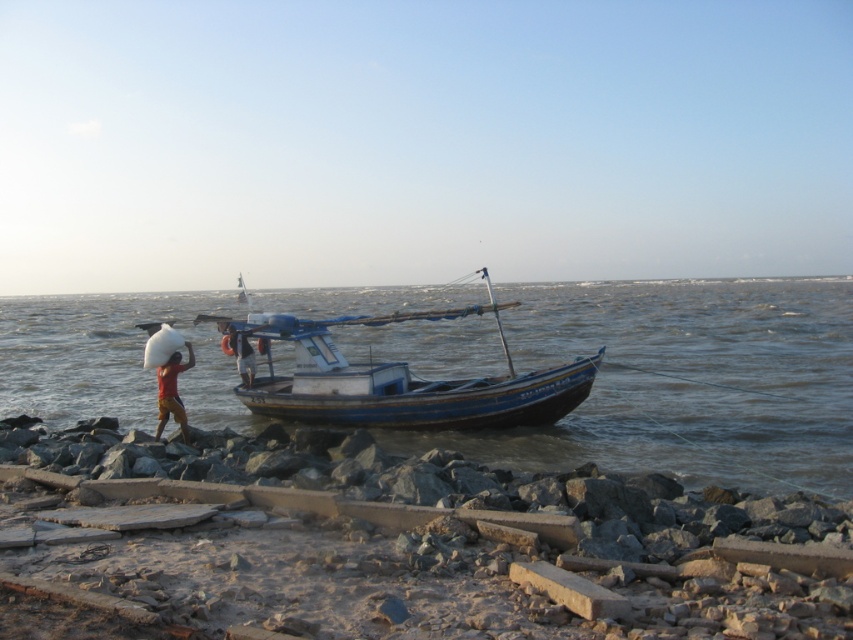
You are standing on the rocky shoreline and want to walk towards the small fishing boat anchored nearby. There are two points marked on the sand, point 1 at coordinates point (175,376) and point 2 at coordinates point (245,371). Which point should you step on first to get closer to the boat?

You should step on point (175,376) first because it is closer to the viewer than point (245,371), so starting there would place you nearer to the boat.

You are standing on the rocky shoreline and want to reach the blue wooden boat at lower center. Based on its 2D coordinates, in which general direction should you walk from your current position at the shoreline?

The blue wooden boat at lower center is located at coordinates approximately 0.597 on the x axis and 0.804 on the y axis. Since you are on the shoreline, which is at the lower part of the image, moving towards the boat would require heading towards the center area where the boat is positioned. Therefore, you should walk towards the center of the scene to reach the blue wooden boat at lower center.